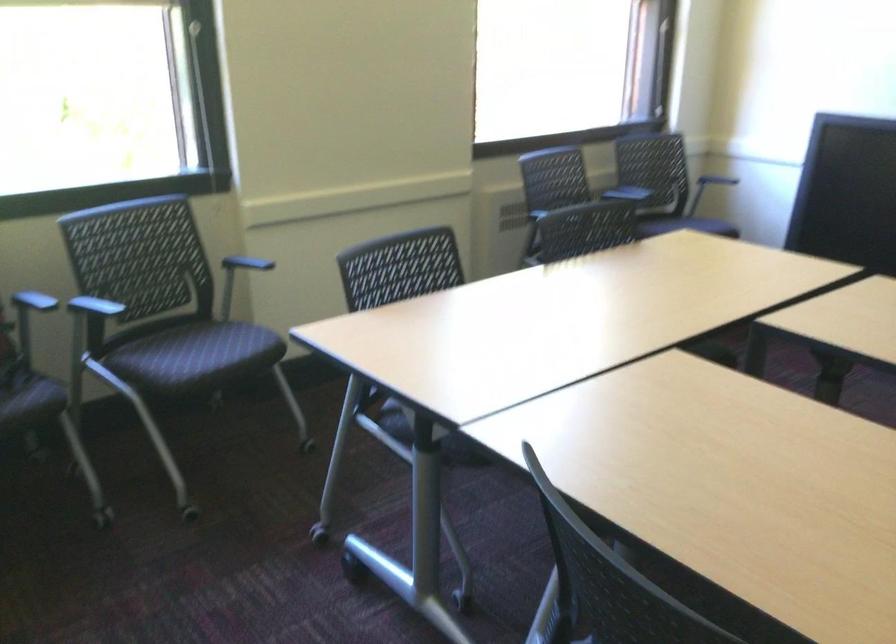
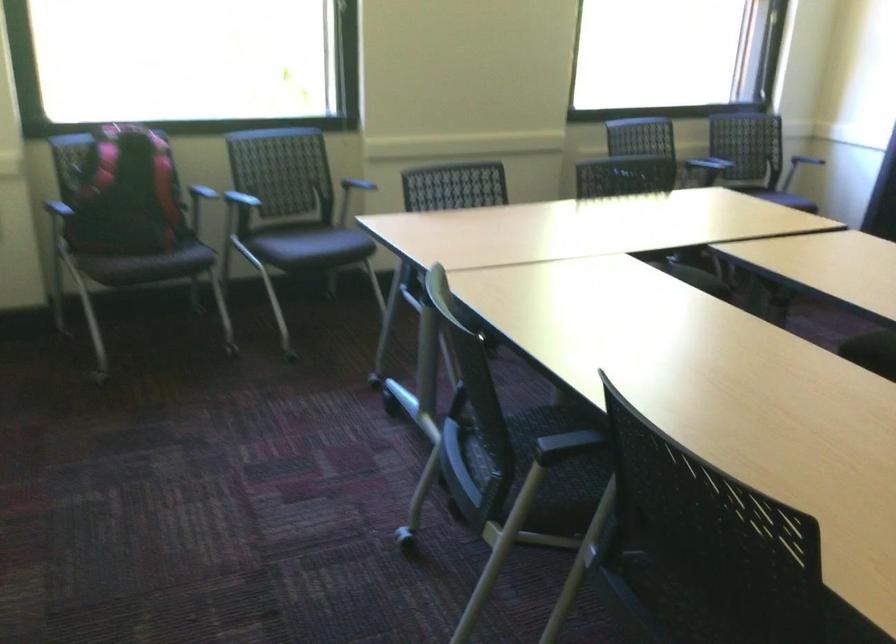
The point at (x=244, y=257) is marked in the first image. Where is the corresponding point in the second image?

(362, 176)